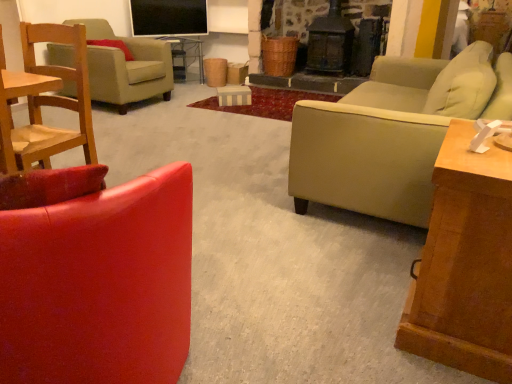
Locate an element on the screen. The width and height of the screenshot is (512, 384). matte red leather chair at left, the 3th chair in the top-to-bottom sequence is located at coordinates (95, 276).

What do you see at coordinates (185, 56) in the screenshot? I see `matte wood side table at center` at bounding box center [185, 56].

Measure the distance between beige leather couch at right and camera.

beige leather couch at right is 1.54 meters from camera.

Image resolution: width=512 pixels, height=384 pixels. Find the location of `velvet red armchair at left, placed as the second chair when sorted from bottom to top`. velvet red armchair at left, placed as the second chair when sorted from bottom to top is located at coordinates (45, 102).

What do you see at coordinates (45, 102) in the screenshot? The height and width of the screenshot is (384, 512). I see `velvet red armchair at left, the 2th chair positioned from the front` at bounding box center [45, 102].

Where is `matte green armchair at left, marked as the 3th chair in a bottom-to-top arrangement`? The height and width of the screenshot is (384, 512). matte green armchair at left, marked as the 3th chair in a bottom-to-top arrangement is located at coordinates (126, 67).

Is matte red leather chair at left, arranged as the 3th chair when viewed from the back, taller than beige leather couch at right?

Indeed, matte red leather chair at left, arranged as the 3th chair when viewed from the back, has a greater height compared to beige leather couch at right.

Is matte red leather chair at left, the 3th chair in the top-to-bottom sequence, bigger or smaller than beige leather couch at right?

In the image, matte red leather chair at left, the 3th chair in the top-to-bottom sequence, appears to be smaller than beige leather couch at right.

Which object is thinner, matte red leather chair at left, which is counted as the 1th chair, starting from the front, or beige leather couch at right?

matte red leather chair at left, which is counted as the 1th chair, starting from the front.

Between suede-like beige pillow at upper left and wooden side table at right, which one has more height?

wooden side table at right is taller.

Between suede-like beige pillow at upper left and wooden side table at right, which one appears on the right side from the viewer's perspective?

Positioned to the right is wooden side table at right.

Could you tell me if suede-like beige pillow at upper left is facing wooden side table at right?

Yes, suede-like beige pillow at upper left faces towards wooden side table at right.

Are matte red leather chair at left, the 3th chair in the top-to-bottom sequence, and velvet red armchair at left, which appears as the 2th chair when viewed from the top, far apart?

That's not correct — matte red leather chair at left, the 3th chair in the top-to-bottom sequence, is a little close to velvet red armchair at left, which appears as the 2th chair when viewed from the top.

From the image's perspective, is matte red leather chair at left, the 3th chair in the top-to-bottom sequence, positioned above or below velvet red armchair at left, placed as the second chair when sorted from bottom to top?

matte red leather chair at left, the 3th chair in the top-to-bottom sequence, is situated lower than velvet red armchair at left, placed as the second chair when sorted from bottom to top, in the image.

Can you confirm if matte red leather chair at left, the 3th chair in the top-to-bottom sequence, is positioned to the right of velvet red armchair at left, which appears as the 2th chair when viewed from the top?

Correct, you'll find matte red leather chair at left, the 3th chair in the top-to-bottom sequence, to the right of velvet red armchair at left, which appears as the 2th chair when viewed from the top.

Between matte red leather chair at left, which is counted as the 1th chair, starting from the front, and velvet red armchair at left, placed as the second chair when sorted from bottom to top, which one has larger size?

matte red leather chair at left, which is counted as the 1th chair, starting from the front, is bigger.

Is velvet red armchair at left, the 2th chair viewed from the back, far away from suede-like beige pillow at upper left?

Yes, velvet red armchair at left, the 2th chair viewed from the back, and suede-like beige pillow at upper left are quite far apart.

Considering the sizes of velvet red armchair at left, placed as the second chair when sorted from bottom to top, and suede-like beige pillow at upper left in the image, is velvet red armchair at left, placed as the second chair when sorted from bottom to top, bigger or smaller than suede-like beige pillow at upper left?

In the image, velvet red armchair at left, placed as the second chair when sorted from bottom to top, appears to be larger than suede-like beige pillow at upper left.

Is velvet red armchair at left, the 2th chair viewed from the back, inside or outside of suede-like beige pillow at upper left?

velvet red armchair at left, the 2th chair viewed from the back, is outside suede-like beige pillow at upper left.

From the image's perspective, relative to suede-like beige pillow at upper left, is matte wood side table at center above or below?

Clearly, from the image's perspective, matte wood side table at center is above suede-like beige pillow at upper left.

At what (x,y) coordinates should I click in order to perform the action: click on side table behind the suede-like beige pillow at upper left. Please return your answer as a coordinate pair (x, y). The width and height of the screenshot is (512, 384). Looking at the image, I should click on (185, 56).

Which object is thinner, matte wood side table at center or suede-like beige pillow at upper left?

suede-like beige pillow at upper left is thinner.

Can you confirm if matte wood side table at center is taller than suede-like beige pillow at upper left?

Correct, matte wood side table at center is much taller as suede-like beige pillow at upper left.

This screenshot has height=384, width=512. What are the coordinates of `table on the right of velvet red armchair at left, the 2th chair viewed from the back` in the screenshot? It's located at (465, 264).

Is wooden side table at right shorter than velvet red armchair at left, the 2th chair viewed from the back?

Correct, wooden side table at right is not as tall as velvet red armchair at left, the 2th chair viewed from the back.

Are wooden side table at right and velvet red armchair at left, the 2th chair viewed from the back, far apart?

That's right, there is a large distance between wooden side table at right and velvet red armchair at left, the 2th chair viewed from the back.

Can you confirm if wooden side table at right is thinner than velvet red armchair at left, the 2th chair positioned from the front?

Indeed, wooden side table at right has a lesser width compared to velvet red armchair at left, the 2th chair positioned from the front.

From the image's perspective, which one is positioned higher, velvet red armchair at left, the 2th chair viewed from the back, or beige leather couch at right?

beige leather couch at right.

Can you confirm if velvet red armchair at left, which appears as the 2th chair when viewed from the top, is positioned to the left of beige leather couch at right?

Yes.

From the image's perspective, starting from the beige leather couch at right, which chair is the 1st one below? Please provide its 2D coordinates.

[(45, 102)]

In terms of width, does velvet red armchair at left, the 2th chair viewed from the back, look wider or thinner when compared to beige leather couch at right?

Clearly, velvet red armchair at left, the 2th chair viewed from the back, has less width compared to beige leather couch at right.

Find the location of a particular element. studio couch that appears behind the matte red leather chair at left, the 3th chair in the top-to-bottom sequence is located at coordinates (390, 134).

Where is `pillow that appears on the left of wooden side table at right`? The image size is (512, 384). pillow that appears on the left of wooden side table at right is located at coordinates (112, 46).

From the image, which object appears to be nearer to velvet red armchair at left, the 2th chair viewed from the back, wooden side table at right or matte wood side table at center?

Based on the image, wooden side table at right appears to be nearer to velvet red armchair at left, the 2th chair viewed from the back.

Based on their spatial positions, is suede-like beige pillow at upper left or velvet red armchair at left, placed as the second chair when sorted from bottom to top, further from wooden side table at right?

suede-like beige pillow at upper left is further to wooden side table at right.

Looking at the image, which one is located further to suede-like beige pillow at upper left, matte red leather chair at left, which is counted as the 1th chair, starting from the front, or wooden side table at right?

Based on the image, wooden side table at right appears to be further to suede-like beige pillow at upper left.

When comparing their distances from matte wood side table at center, does beige leather couch at right or velvet red armchair at left, placed as the second chair when sorted from bottom to top, seem closer?

velvet red armchair at left, placed as the second chair when sorted from bottom to top, lies closer to matte wood side table at center than the other object.

Considering their positions, is wooden side table at right positioned closer to matte green armchair at left, positioned as the 1th chair in top-to-bottom order, than beige leather couch at right?

Among the two, beige leather couch at right is located nearer to matte green armchair at left, positioned as the 1th chair in top-to-bottom order.

Consider the image. When comparing their distances from suede-like beige pillow at upper left, does matte green armchair at left, marked as the 3th chair in a bottom-to-top arrangement, or velvet red armchair at left, placed as the second chair when sorted from bottom to top, seem closer?

matte green armchair at left, marked as the 3th chair in a bottom-to-top arrangement.

Which object lies nearer to the anchor point velvet red armchair at left, the 2th chair positioned from the front, matte green armchair at left, marked as the first chair in a back-to-front arrangement, or matte wood side table at center?

The object closer to velvet red armchair at left, the 2th chair positioned from the front, is matte green armchair at left, marked as the first chair in a back-to-front arrangement.

When comparing their distances from suede-like beige pillow at upper left, does beige leather couch at right or wooden side table at right seem further?

wooden side table at right is further to suede-like beige pillow at upper left.

Locate an element on the screen. Image resolution: width=512 pixels, height=384 pixels. chair located between matte red leather chair at left, arranged as the 3th chair when viewed from the back, and matte green armchair at left, marked as the first chair in a back-to-front arrangement, in the depth direction is located at coordinates (45, 102).

Locate an element on the screen. The width and height of the screenshot is (512, 384). studio couch between velvet red armchair at left, the 2th chair positioned from the front, and matte wood side table at center, along the z-axis is located at coordinates (390, 134).

I want to click on studio couch between matte red leather chair at left, which is counted as the 1th chair, starting from the front, and matte green armchair at left, marked as the first chair in a back-to-front arrangement, along the z-axis, so click(390, 134).

At what (x,y) coordinates should I click in order to perform the action: click on pillow located between wooden side table at right and matte wood side table at center in the depth direction. Please return your answer as a coordinate pair (x, y). The height and width of the screenshot is (384, 512). Looking at the image, I should click on (x=112, y=46).